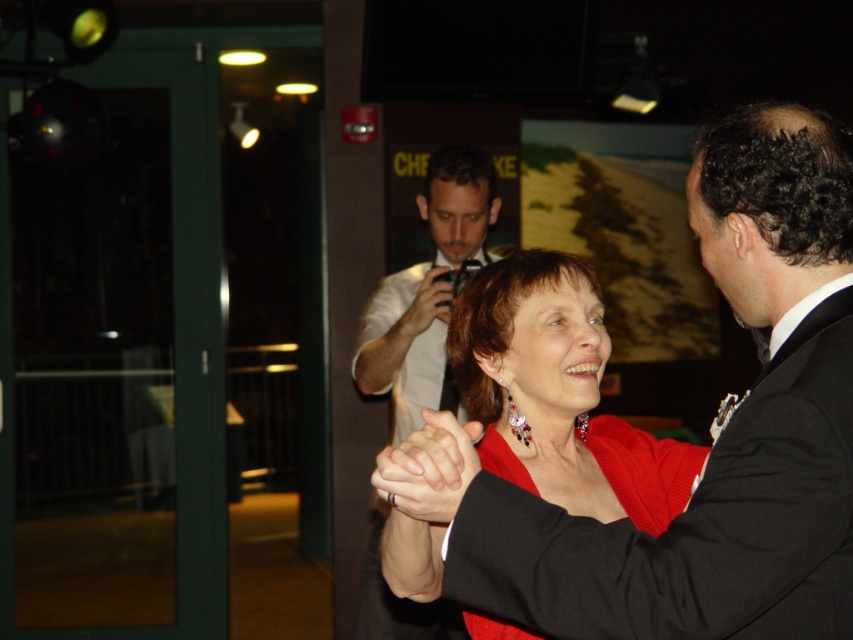
Question: Can you confirm if white shirt at center is positioned to the left of smooth black hand at center?

Choices:
 (A) no
 (B) yes

Answer: (B)

Question: Does matte red dress at center have a larger size compared to smooth skin hand at center?

Choices:
 (A) yes
 (B) no

Answer: (A)

Question: Among these points, which one is nearest to the camera?

Choices:
 (A) (410, 500)
 (B) (480, 234)
 (C) (407, 330)
 (D) (584, 397)

Answer: (A)

Question: Which object is positioned farthest from the smooth skin hand at center?

Choices:
 (A) matte red dress at center
 (B) white shirt at center

Answer: (A)

Question: From the image, what is the correct spatial relationship of matte red dress at center in relation to smooth skin hand at center?

Choices:
 (A) right
 (B) left

Answer: (A)

Question: Which point is farther to the camera?

Choices:
 (A) smooth black hand at center
 (B) white shirt at center
 (C) smooth skin hand at center
 (D) matte red dress at center

Answer: (C)